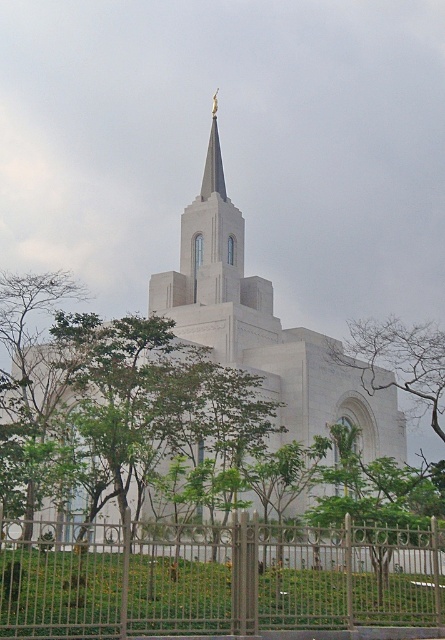
You are standing at the entrance of the grand white temple and want to walk towards the central spire. Is the metallic silver fence at lower center blocking your path? Please explain your reasoning based on its position.

The metallic silver fence at lower center is positioned at point [217,579]. Since the coordinates place it near the lower center of the image, it likely forms a boundary at the entrance area. Therefore, the metallic silver fence at lower center is blocking your path to the central spire unless there is a gate or opening in the fence.

You are a visitor standing at the entrance of the temple grounds. You see the metallic silver fence at lower center and the white stone church at center. Which object has a smaller width?

The metallic silver fence at lower center is thinner than the white stone church at center, so the metallic silver fence at lower center has a smaller width.